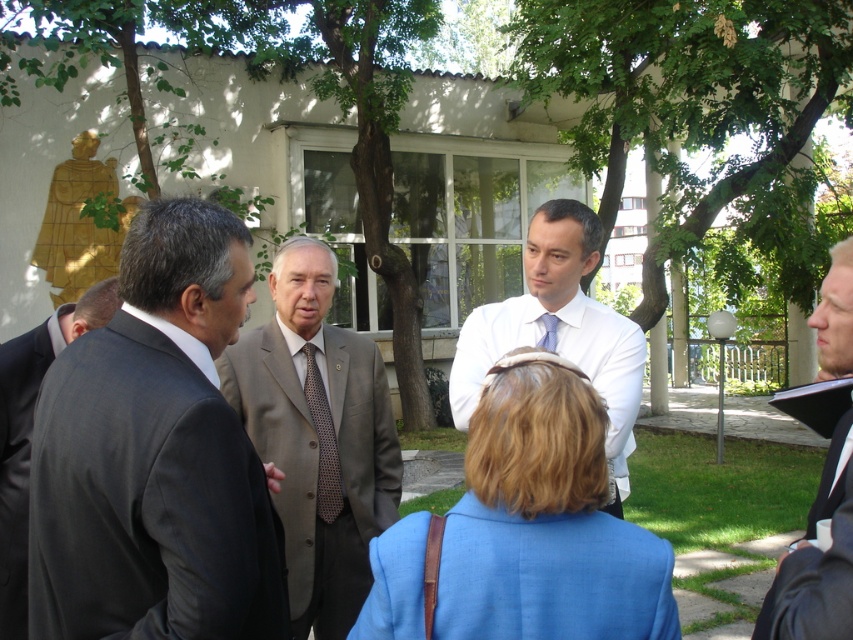
Does brown textured suit at center lie behind blue silk tie at center?

That is False.

Which of these two, brown textured suit at center or blue silk tie at center, stands shorter?

blue silk tie at center is shorter.

Looking at this image, who is more distant from viewer, (x=386, y=493) or (x=553, y=314)?

The point (x=386, y=493) is behind.

Image resolution: width=853 pixels, height=640 pixels. What are the coordinates of `brown textured suit at center` in the screenshot? It's located at click(x=318, y=436).

Can you confirm if dark gray suit at left is positioned to the right of polka dot silk tie at center?

In fact, dark gray suit at left is to the left of polka dot silk tie at center.

Which is below, dark gray suit at left or polka dot silk tie at center?

Positioned lower is dark gray suit at left.

Between point (9, 465) and point (328, 506), which one is positioned behind?

Positioned behind is point (328, 506).

You are a GUI agent. You are given a task and a screenshot of the screen. Output one action in this format:
    pyautogui.click(x=<x>, y=<y>)
    Task: Click on the dark gray suit at left
    Image resolution: width=853 pixels, height=640 pixels.
    Given the screenshot: What is the action you would take?
    point(19,460)

Can you confirm if white glossy shirt at center is smaller than blonde hair at right?

A: No.

Consider the image. Is white glossy shirt at center below blonde hair at right?

Incorrect, white glossy shirt at center is not positioned below blonde hair at right.

Does point (529, 264) lie behind point (842, 307)?

Yes, it is.

You are a GUI agent. You are given a task and a screenshot of the screen. Output one action in this format:
    pyautogui.click(x=<x>, y=<y>)
    Task: Click on the white glossy shirt at center
    Image resolution: width=853 pixels, height=640 pixels.
    Given the screenshot: What is the action you would take?
    pyautogui.click(x=560, y=330)